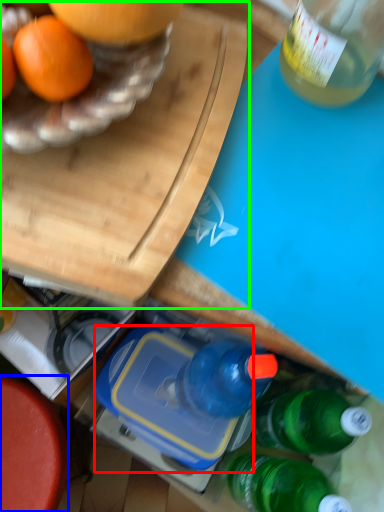
Question: Which object is the farthest from lunch box (highlighted by a red box)? Choose among these: round table (highlighted by a blue box) or cutting board (highlighted by a green box).

Choices:
 (A) round table
 (B) cutting board

Answer: (B)